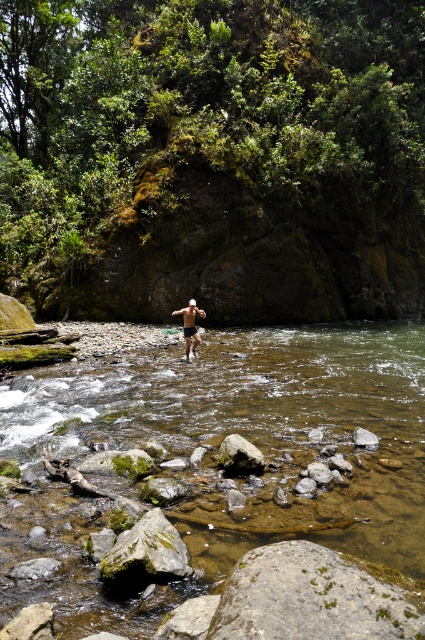
From the picture: Between smooth gray rock at center and gray smooth rock at lower center, which one is positioned lower?

gray smooth rock at lower center

Can you confirm if smooth gray rock at center is positioned to the left of gray smooth rock at lower center?

Correct, you'll find smooth gray rock at center to the left of gray smooth rock at lower center.

Image resolution: width=425 pixels, height=640 pixels. What are the coordinates of `smooth gray rock at center` in the screenshot? It's located at (240, 456).

Is mossy gray rock at lower center in front of smooth gray rock at center?

Yes.

Can you confirm if mossy gray rock at lower center is wider than smooth gray rock at center?

Yes.

This screenshot has height=640, width=425. Describe the element at coordinates (314, 596) in the screenshot. I see `mossy gray rock at lower center` at that location.

I want to click on mossy gray rock at lower center, so (314, 596).

Is point (189, 324) farther from viewer compared to point (187, 326)?

No, (189, 324) is closer to viewer.

The height and width of the screenshot is (640, 425). What do you see at coordinates (189, 324) in the screenshot?
I see `shiny silver shorts at center` at bounding box center [189, 324].

Between point (187, 337) and point (189, 333), which one is positioned in front?

Point (189, 333) is more forward.

Locate an element on the screen. shiny silver shorts at center is located at coordinates (189, 324).